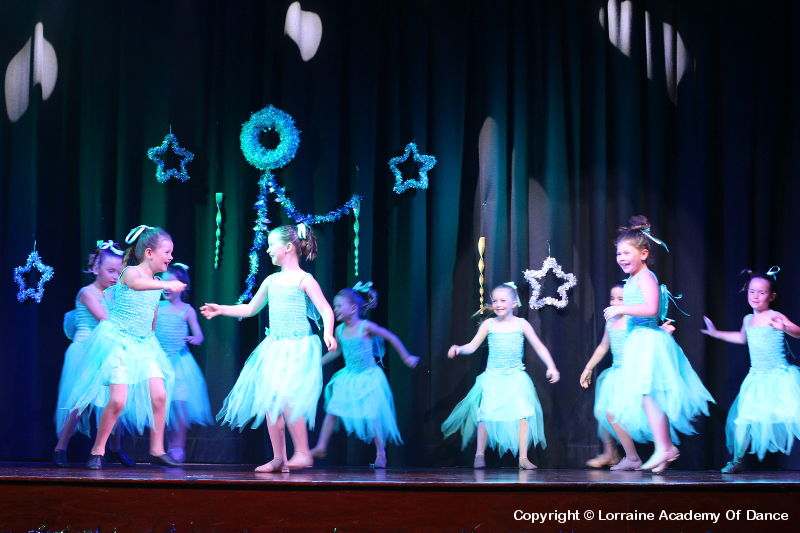
Where is `white lights`? This screenshot has width=800, height=533. white lights is located at coordinates (54, 88), (318, 47), (689, 29).